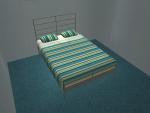
This screenshot has height=113, width=150. What are the coordinates of `left pillow` in the screenshot? It's located at (48, 36).